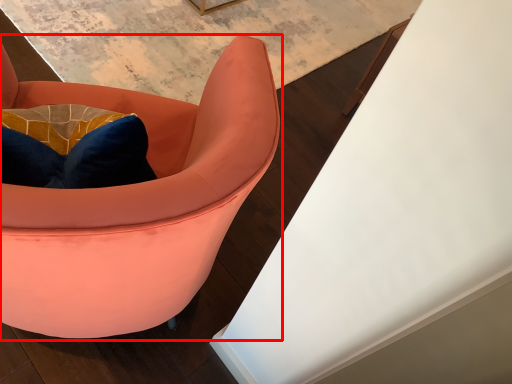
Question: From the image's perspective, what is the correct spatial positioning of chair (annotated by the red box) in reference to table?

Choices:
 (A) below
 (B) above

Answer: (A)